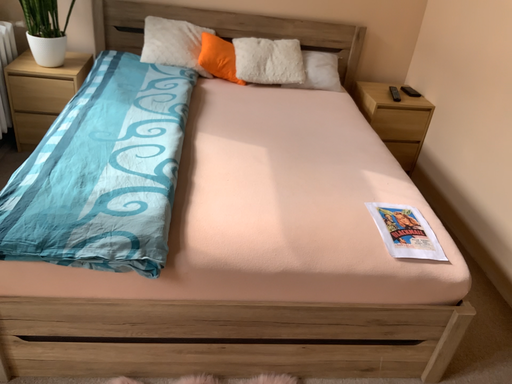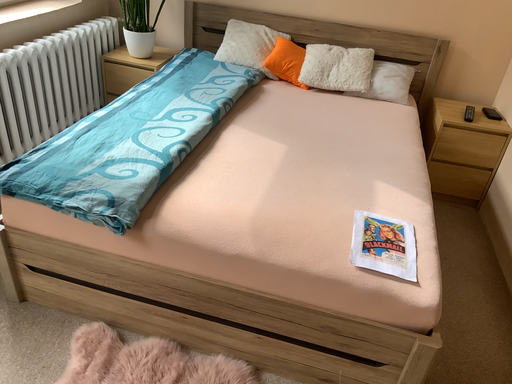
Question: Which way did the camera rotate in the video?

Choices:
 (A) rotated left
 (B) rotated right

Answer: (A)